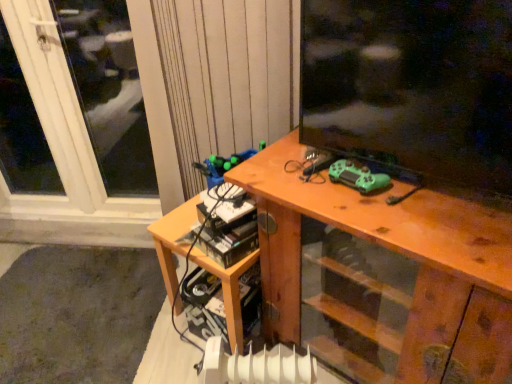
Question: Considering the relative positions of wooden desk at center and white plastic window at upper left in the image provided, is wooden desk at center behind white plastic window at upper left?

Choices:
 (A) no
 (B) yes

Answer: (A)

Question: Would you say wooden desk at center contains white plastic window at upper left?

Choices:
 (A) yes
 (B) no

Answer: (B)

Question: From the image's perspective, is wooden desk at center under white plastic window at upper left?

Choices:
 (A) yes
 (B) no

Answer: (A)

Question: From the image's perspective, is wooden desk at center above white plastic window at upper left?

Choices:
 (A) yes
 (B) no

Answer: (B)

Question: Is wooden desk at center looking in the opposite direction of white plastic window at upper left?

Choices:
 (A) no
 (B) yes

Answer: (A)

Question: Considering the positions of white plastic window at upper left and white plastic radiator at lower center in the image, is white plastic window at upper left taller or shorter than white plastic radiator at lower center?

Choices:
 (A) short
 (B) tall

Answer: (B)

Question: Does point (53, 178) appear closer or farther from the camera than point (206, 364)?

Choices:
 (A) farther
 (B) closer

Answer: (A)

Question: From the image's perspective, is white plastic window at upper left positioned above or below white plastic radiator at lower center?

Choices:
 (A) above
 (B) below

Answer: (A)

Question: Based on their positions, is white plastic window at upper left located to the left or right of white plastic radiator at lower center?

Choices:
 (A) left
 (B) right

Answer: (A)

Question: From the image's perspective, is wooden table at lower left above or below white plastic radiator at lower center?

Choices:
 (A) below
 (B) above

Answer: (B)

Question: Do you think wooden table at lower left is within white plastic radiator at lower center, or outside of it?

Choices:
 (A) outside
 (B) inside

Answer: (A)

Question: Looking at their shapes, would you say wooden table at lower left is wider or thinner than white plastic radiator at lower center?

Choices:
 (A) thin
 (B) wide

Answer: (B)

Question: Considering their positions, is wooden table at lower left located in front of or behind white plastic radiator at lower center?

Choices:
 (A) front
 (B) behind

Answer: (B)

Question: In terms of size, does white plastic window at upper left appear bigger or smaller than wooden table at lower left?

Choices:
 (A) small
 (B) big

Answer: (A)

Question: Is white plastic window at upper left taller or shorter than wooden table at lower left?

Choices:
 (A) tall
 (B) short

Answer: (A)